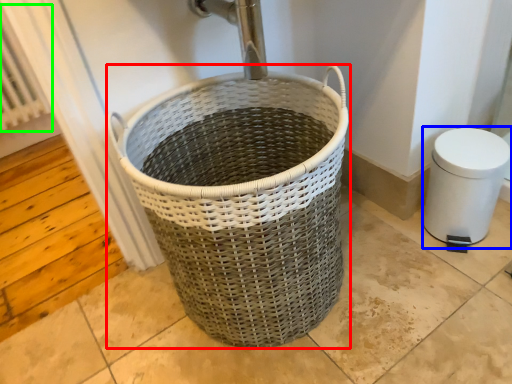
Question: Considering the real-world distances, which object is farthest from waste container (highlighted by a red box)? bidet (highlighted by a blue box) or radiator (highlighted by a green box)?

Choices:
 (A) bidet
 (B) radiator

Answer: (B)